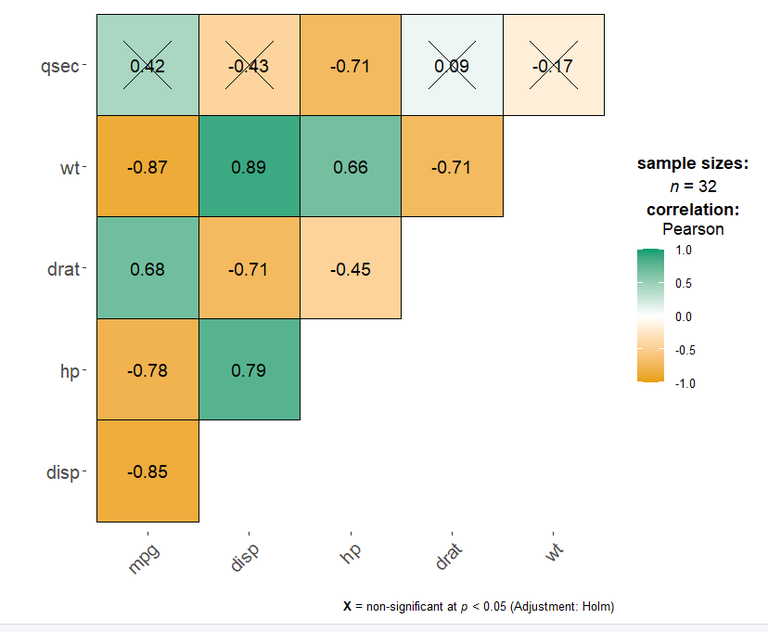
Where is `display`? display is located at coordinates (247, 557).